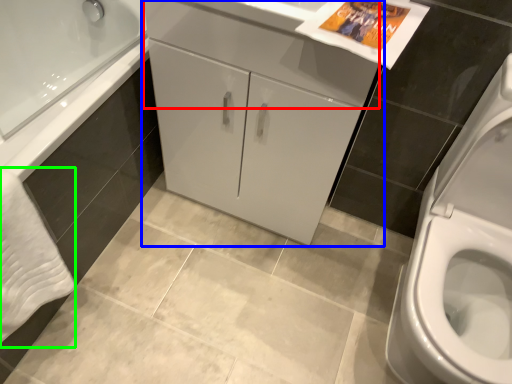
Question: Estimate the real-world distances between objects in this image. Which object is closer to drawer (highlighted by a red box), bathroom cabinet (highlighted by a blue box) or bath towel (highlighted by a green box)?

Choices:
 (A) bathroom cabinet
 (B) bath towel

Answer: (A)